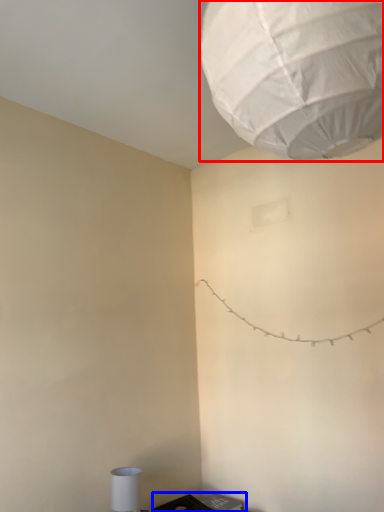
Question: Which object is further to the camera taking this photo, lantern (highlighted by a red box) or furniture (highlighted by a blue box)?

Choices:
 (A) lantern
 (B) furniture

Answer: (B)